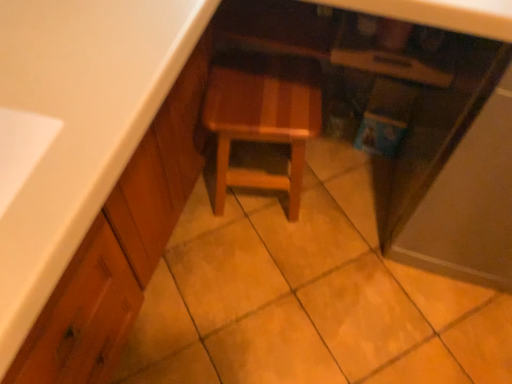
Find the location of a particular element. The width and height of the screenshot is (512, 384). wooden stool at center is located at coordinates (263, 119).

What do you see at coordinates (263, 119) in the screenshot? This screenshot has height=384, width=512. I see `wooden stool at center` at bounding box center [263, 119].

Find the location of a particular element. Image resolution: width=512 pixels, height=384 pixels. wooden stool at center is located at coordinates (263, 119).